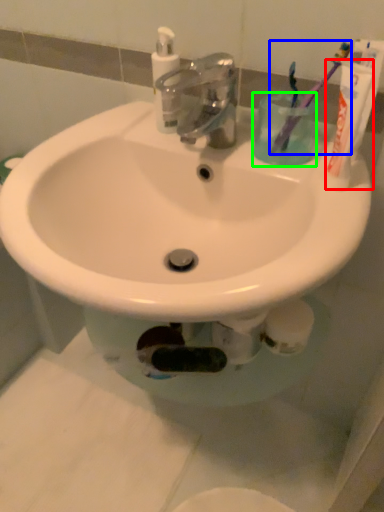
Question: Which object is positioned closest to toothpaste (highlighted by a red box)? Select from toothbrush (highlighted by a blue box) and liquid (highlighted by a green box).

Choices:
 (A) toothbrush
 (B) liquid

Answer: (A)